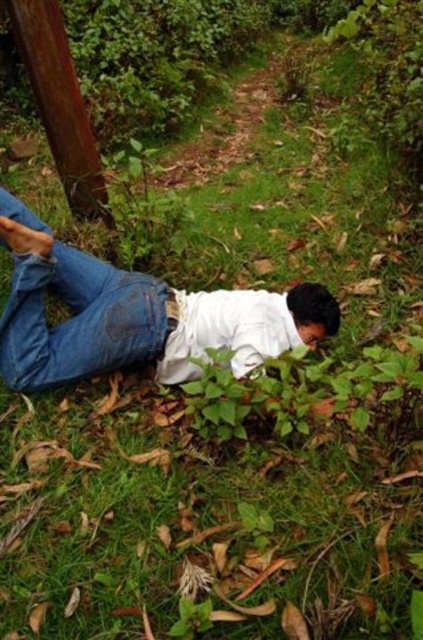
Question: Among these points, which one is nearest to the camera?

Choices:
 (A) (46, 65)
 (B) (21, 266)

Answer: (B)

Question: Which object appears farthest from the camera in this image?

Choices:
 (A) denim at left
 (B) brushed wood telegraph pole at upper left

Answer: (B)

Question: Does jeans at lower left appear on the right side of brushed wood telegraph pole at upper left?

Choices:
 (A) yes
 (B) no

Answer: (A)

Question: Does jeans at lower left have a smaller size compared to brushed wood telegraph pole at upper left?

Choices:
 (A) no
 (B) yes

Answer: (A)

Question: Which point is closer to the camera taking this photo?

Choices:
 (A) (69, 275)
 (B) (98, 260)
 (C) (91, 204)

Answer: (A)

Question: Considering the relative positions of denim at left and brushed wood telegraph pole at upper left in the image provided, where is denim at left located with respect to brushed wood telegraph pole at upper left?

Choices:
 (A) above
 (B) below

Answer: (B)